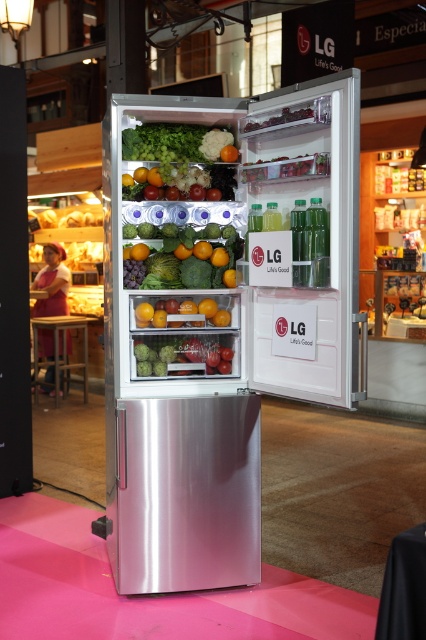
You are a grocery store employee who needs to place a large container that requires 30 cm of space. You see the green matte cauliflower at upper center and the green matte avocados at center inside the open refrigerator. Can the container fit between these two items?

The green matte cauliflower at upper center is larger than the green matte avocados at center. However, the exact distance between them isn not specified in the description. Therefore, it is uncertain if the container will fit.

You are a delivery person who needs to move the smooth orange at center to another location. The path is only as wide as the satin silver refrigerator at center. Can you pass through with the orange?

The satin silver refrigerator at center is wider than the smooth orange at center. Since the path is as wide as the refrigerator, the orange will fit through the path.